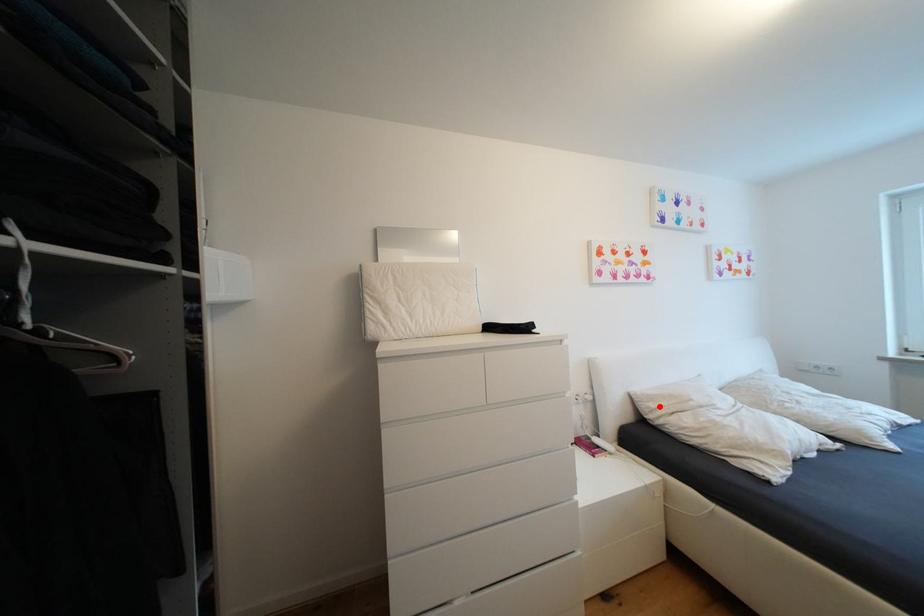
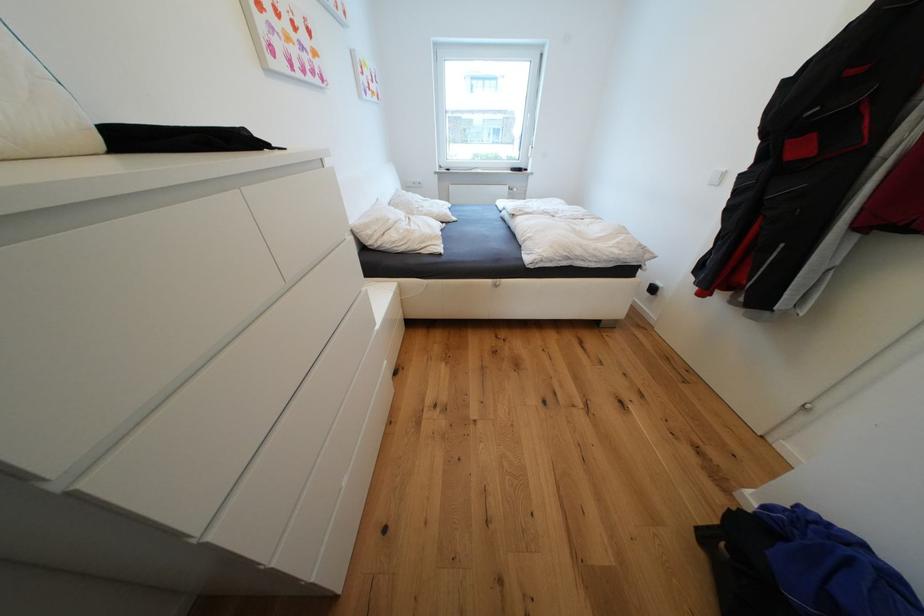
Question: I am providing you with two images of the same scene from different viewpoints. A red point is shown in image1. For the corresponding object point in image2, is it positioned nearer or farther from the camera?

Choices:
 (A) Nearer
 (B) Farther

Answer: (A)